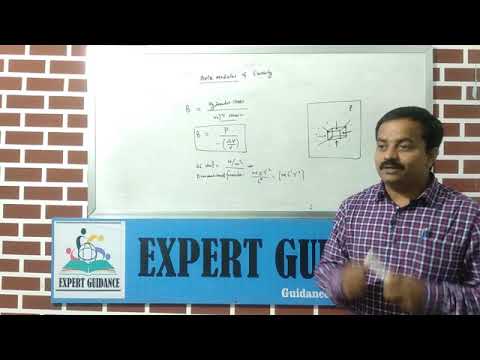
Identify the location of pen. (426, 232).